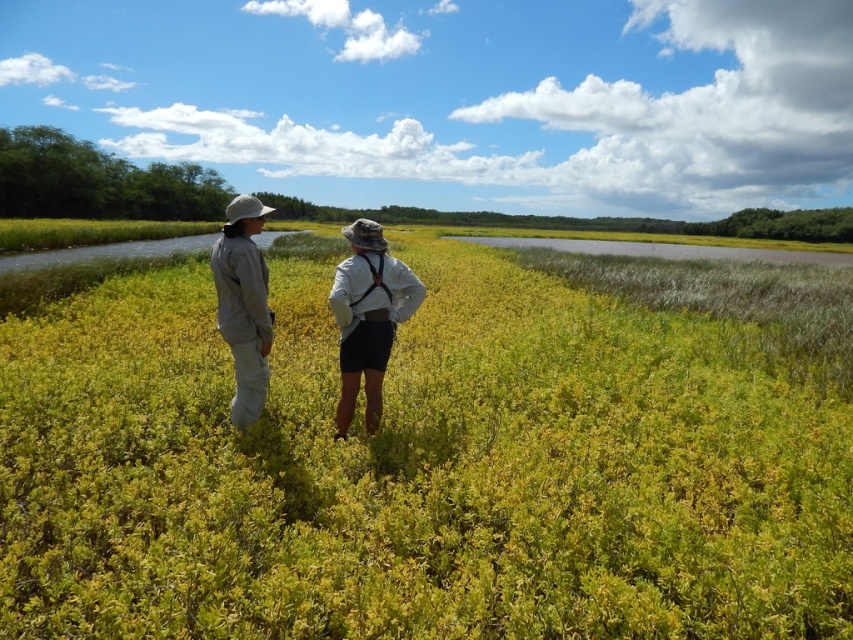
From the picture: You are a photographer aiming to capture both the khaki fabric pants at center and the gray fabric jacket at left in a single frame. Based on their positions, which object should you focus on first to ensure both are in focus?

The khaki fabric pants at center is above the gray fabric jacket at left, so focusing on the gray fabric jacket at left first would ensure both are in focus as the pants are higher up but the jacket is lower, so adjusting focus for the lower object might help capture both.

You are a photographer trying to capture both the khaki fabric pants at center and the gray fabric jacket at left in a single frame. Which object should you focus on first to ensure both are in the frame?

You should focus on the gray fabric jacket at left first because it is larger than the khaki fabric pants at center, ensuring it fits within the frame while still capturing the smaller pants.

You are a hiker trying to cross the marshland. You see the green leafy grass at center and the gray fabric jacket at left. Which object is closer to you as you stand on the path?

The green leafy grass at center is closer to the viewer than the gray fabric jacket at left, so the green leafy grass at center is closer to you.